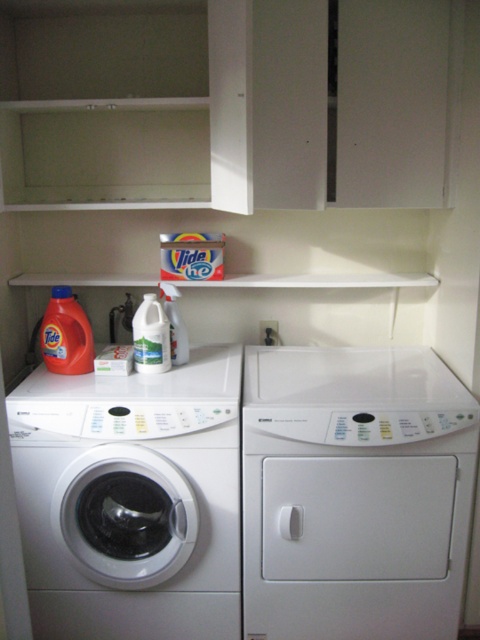
Who is positioned more to the right, white glossy washing machine at lower left or clear plastic bottle at center?

clear plastic bottle at center is more to the right.

Who is more forward, (120, 572) or (170, 292)?

Point (120, 572) is in front.

I want to click on white glossy washing machine at lower left, so click(x=131, y=499).

Based on the photo, can you confirm if white matte dryer at right is bigger than white glossy jug at center?

Indeed, white matte dryer at right has a larger size compared to white glossy jug at center.

Who is positioned more to the left, white matte dryer at right or white glossy jug at center?

white glossy jug at center is more to the left.

The height and width of the screenshot is (640, 480). What do you see at coordinates (355, 492) in the screenshot?
I see `white matte dryer at right` at bounding box center [355, 492].

Identify the location of white matte dryer at right. (355, 492).

Does matte orange detergent at lower left come in front of clear plastic bottle at center?

Yes, matte orange detergent at lower left is closer to the viewer.

Can you confirm if matte orange detergent at lower left is positioned above clear plastic bottle at center?

No, matte orange detergent at lower left is not above clear plastic bottle at center.

Identify the location of matte orange detergent at lower left. The image size is (480, 640). (66, 333).